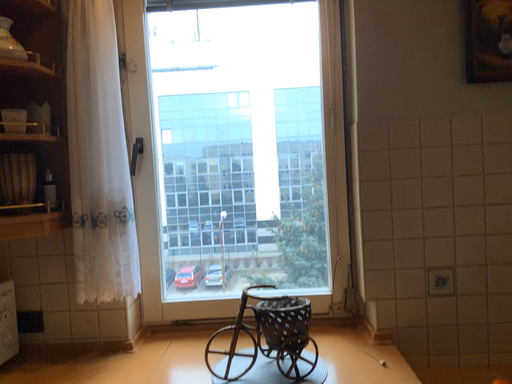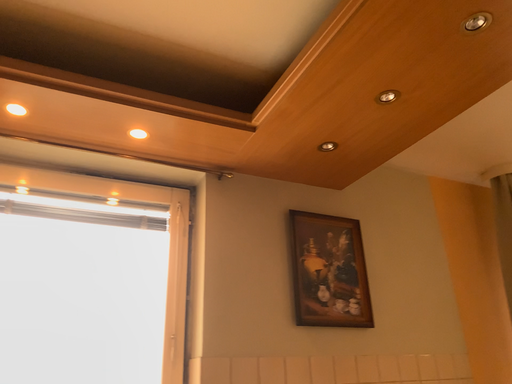
Question: How did the camera likely rotate when shooting the video?

Choices:
 (A) rotated right
 (B) rotated left

Answer: (A)